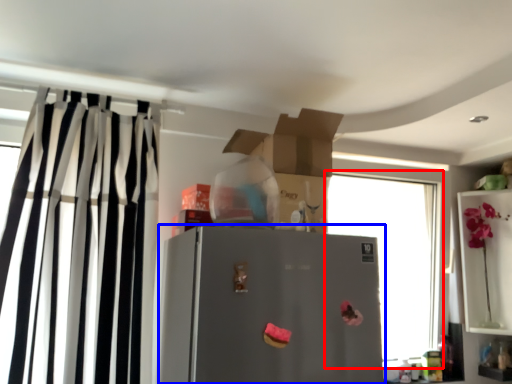
Question: Which object appears closest to the camera in this image, window (highlighted by a red box) or refrigerator (highlighted by a blue box)?

Choices:
 (A) window
 (B) refrigerator

Answer: (B)